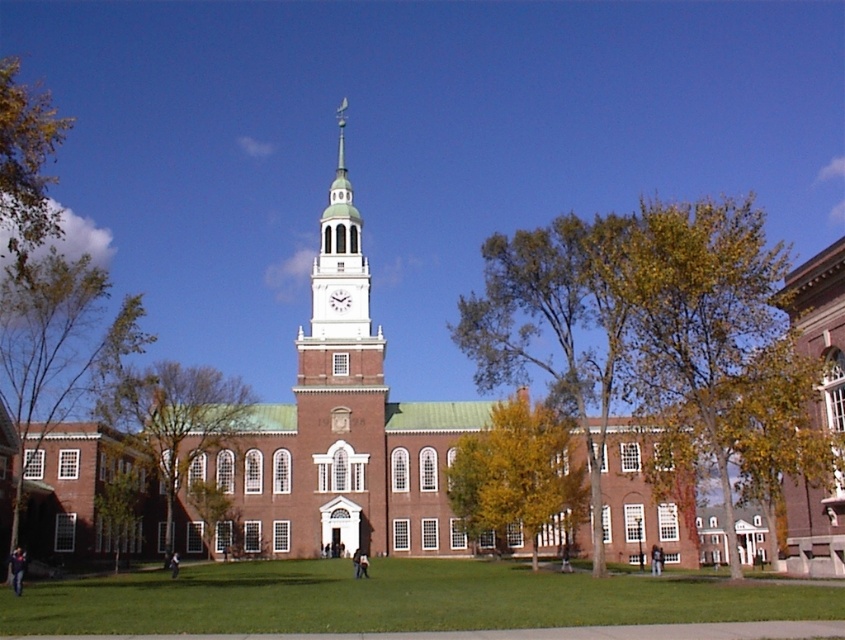
Question: Does green leafy tree at left have a greater width compared to green leafy tree at lower left?

Choices:
 (A) no
 (B) yes

Answer: (B)

Question: Considering the real-world distances, which object is closest to the yellow-green leaves at upper right?

Choices:
 (A) green leafy tree at left
 (B) white glossy clock at center

Answer: (B)

Question: Which point is closer to the camera?

Choices:
 (A) white painted wood clock tower at center
 (B) yellow-green leaves at upper right

Answer: (B)

Question: Among these objects, which one is farthest from the camera?

Choices:
 (A) yellow-green leaves at center
 (B) white painted wood clock tower at center

Answer: (B)

Question: Is green leafy tree at left further to the viewer compared to white painted wood clock tower at center?

Choices:
 (A) yes
 (B) no

Answer: (B)

Question: Where is green leafy tree at center located in relation to white glossy clock at center in the image?

Choices:
 (A) left
 (B) right

Answer: (A)